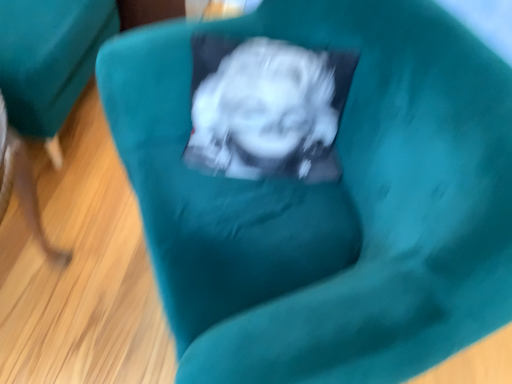
You are a GUI agent. You are given a task and a screenshot of the screen. Output one action in this format:
    pyautogui.click(x=<x>, y=<y>)
    Task: Click on the teal fabric chair at upper left
    
    Given the screenshot: What is the action you would take?
    pyautogui.click(x=49, y=60)

What do you see at coordinates (49, 60) in the screenshot? I see `teal fabric chair at upper left` at bounding box center [49, 60].

The height and width of the screenshot is (384, 512). Identify the location of teal fabric chair at upper left. (49, 60).